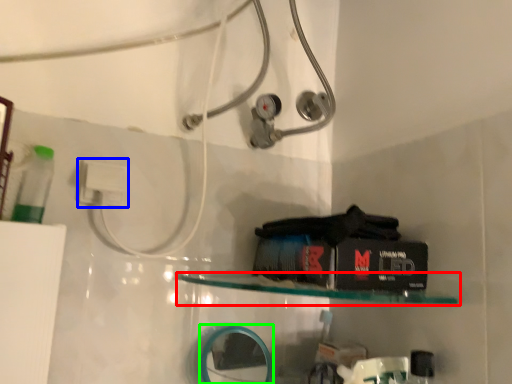
Question: Estimate the real-world distances between objects in this image. Which object is farther from shelf (highlighted by a red box), electric outlet (highlighted by a blue box) or mirror (highlighted by a green box)?

Choices:
 (A) electric outlet
 (B) mirror

Answer: (A)